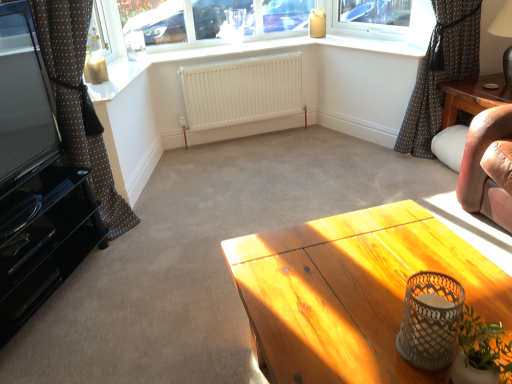
Question: Does white matte vase at lower right have a greater height compared to brown dotted fabric at right, the first curtain positioned from the right?

Choices:
 (A) yes
 (B) no

Answer: (B)

Question: Is white matte vase at lower right located outside brown dotted fabric at right, the first curtain positioned from the right?

Choices:
 (A) yes
 (B) no

Answer: (A)

Question: Is white matte vase at lower right facing towards brown dotted fabric at right, marked as the 2th curtain in a left-to-right arrangement?

Choices:
 (A) yes
 (B) no

Answer: (B)

Question: Is white matte vase at lower right next to brown dotted fabric at right, marked as the 2th curtain in a left-to-right arrangement, and touching it?

Choices:
 (A) no
 (B) yes

Answer: (A)

Question: Are white matte vase at lower right and brown dotted fabric at right, marked as the 2th curtain in a left-to-right arrangement, located far from each other?

Choices:
 (A) no
 (B) yes

Answer: (B)

Question: Would you say white matte vase at lower right contains brown dotted fabric at right, the first curtain positioned from the right?

Choices:
 (A) no
 (B) yes

Answer: (A)

Question: Is brown polka dot fabric at left, which is counted as the 2th curtain, starting from the right, not inside white matte vase at lower right?

Choices:
 (A) no
 (B) yes

Answer: (B)

Question: From the image's perspective, is brown polka dot fabric at left, which is counted as the 2th curtain, starting from the right, located beneath white matte vase at lower right?

Choices:
 (A) yes
 (B) no

Answer: (B)

Question: From a real-world perspective, is brown polka dot fabric at left, which is counted as the 2th curtain, starting from the right, on white matte vase at lower right?

Choices:
 (A) no
 (B) yes

Answer: (B)

Question: Can you confirm if brown polka dot fabric at left, which is counted as the 2th curtain, starting from the right, is thinner than white matte vase at lower right?

Choices:
 (A) yes
 (B) no

Answer: (B)

Question: Is brown polka dot fabric at left, the first curtain positioned from the left, directly adjacent to white matte vase at lower right?

Choices:
 (A) yes
 (B) no

Answer: (B)

Question: Considering the relative positions of brown polka dot fabric at left, which is counted as the 2th curtain, starting from the right, and white matte vase at lower right in the image provided, is brown polka dot fabric at left, which is counted as the 2th curtain, starting from the right, behind white matte vase at lower right?

Choices:
 (A) yes
 (B) no

Answer: (A)

Question: Does matte white window sill at upper center come in front of brown polka dot fabric at left, which is counted as the 2th curtain, starting from the right?

Choices:
 (A) no
 (B) yes

Answer: (A)